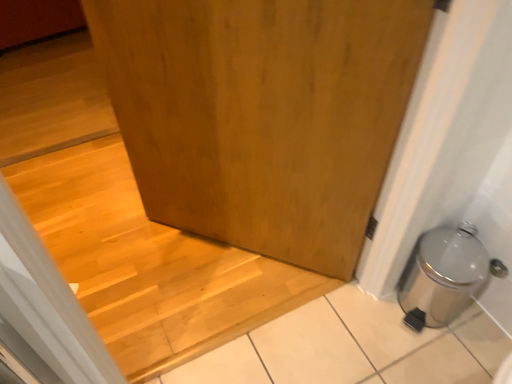
Identify the location of vacant space situated above wooden at center (from a real-world perspective). (122, 234).